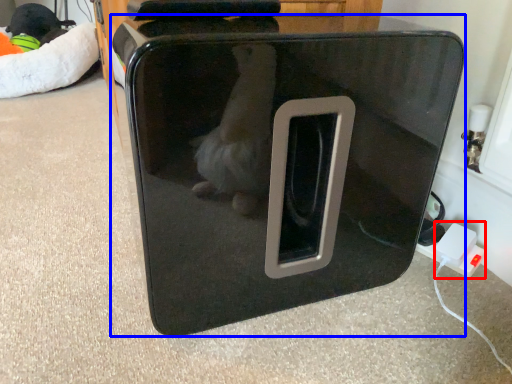
Question: Which object appears closest to the camera in this image, electric outlet (highlighted by a red box) or home appliance (highlighted by a blue box)?

Choices:
 (A) electric outlet
 (B) home appliance

Answer: (B)